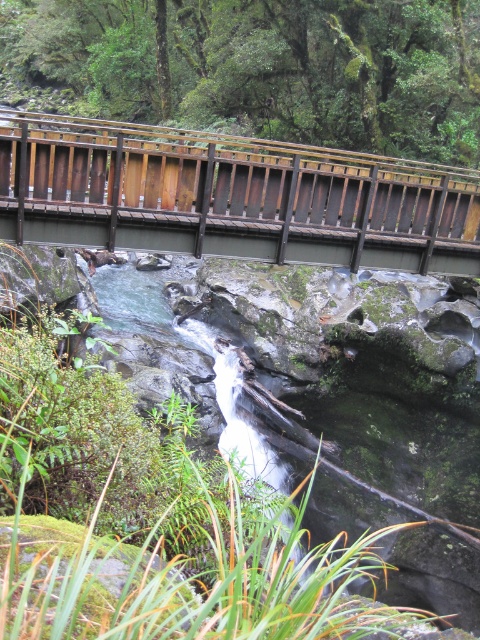
Question: Does green mossy rocks at upper center come behind brown wooden bridge at upper center?

Choices:
 (A) yes
 (B) no

Answer: (A)

Question: Which point appears closest to the camera in this image?

Choices:
 (A) (14, 122)
 (B) (163, 38)

Answer: (A)

Question: Can you confirm if green mossy rocks at upper center is bigger than brown wooden bridge at upper center?

Choices:
 (A) no
 (B) yes

Answer: (B)

Question: From the image, what is the correct spatial relationship of green mossy rocks at upper center in relation to brown wooden bridge at upper center?

Choices:
 (A) above
 (B) below

Answer: (A)

Question: Which of the following is the closest to the observer?

Choices:
 (A) brown wooden bridge at upper center
 (B) green mossy rocks at upper center

Answer: (A)

Question: Which point appears farthest from the camera in this image?

Choices:
 (A) (260, 132)
 (B) (3, 116)

Answer: (A)